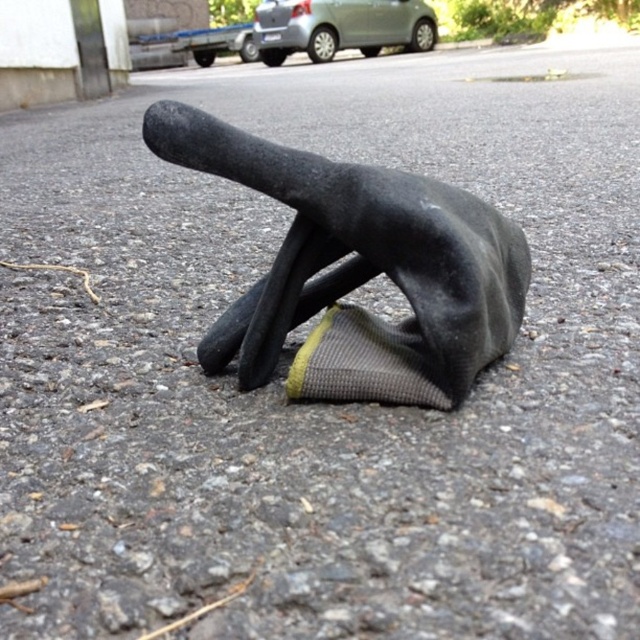
In the scene shown: You are a pedestrian walking on the road and see the black rubber glove at center and the satin silver car at upper center. Which object is closer to you?

The black rubber glove at center is closer to you since it is positioned in front of the satin silver car at upper center.

You are a delivery driver who just arrived at a parking lot. You see a black rubber glove at center and a satin silver car at upper center. Which object is closer to the ground?

The black rubber glove at center is closer to the ground since it is not as tall as the satin silver car at upper center.